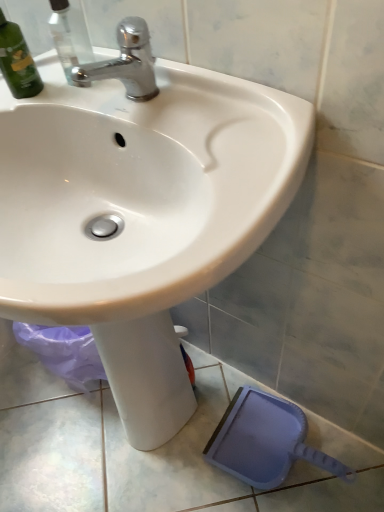
The image size is (384, 512). What are the coordinates of `free space in front of chrome metallic faucet at upper center` in the screenshot? It's located at (186, 135).